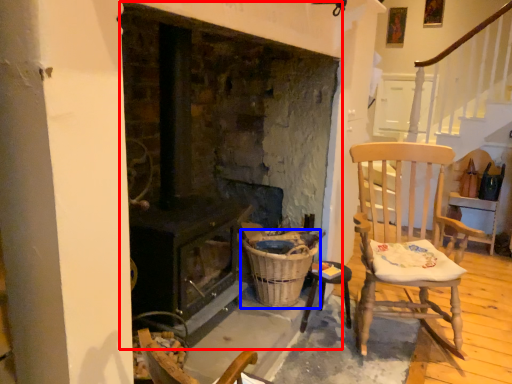
Question: Which point is further to the camera, fireplace (highlighted by a red box) or basket (highlighted by a blue box)?

Choices:
 (A) fireplace
 (B) basket

Answer: (B)